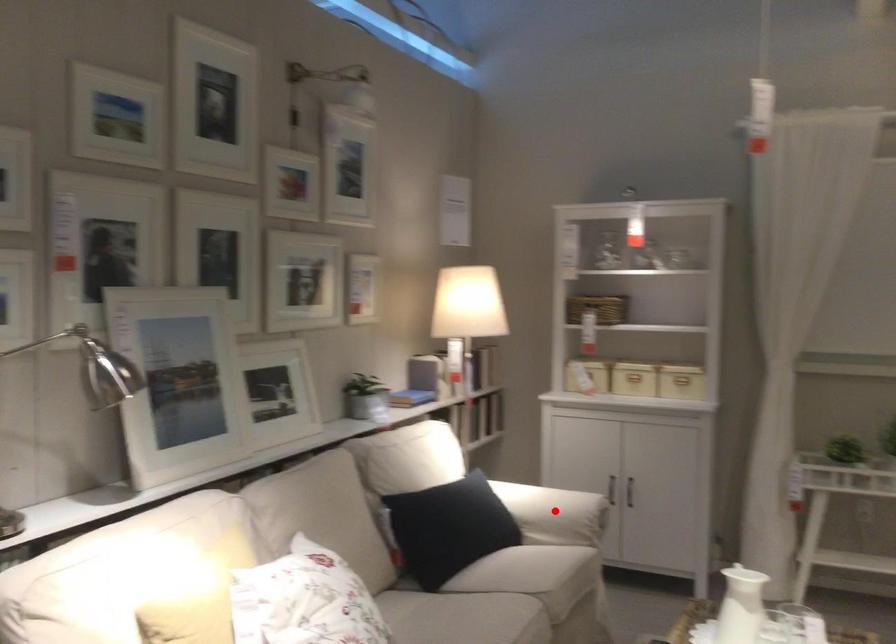
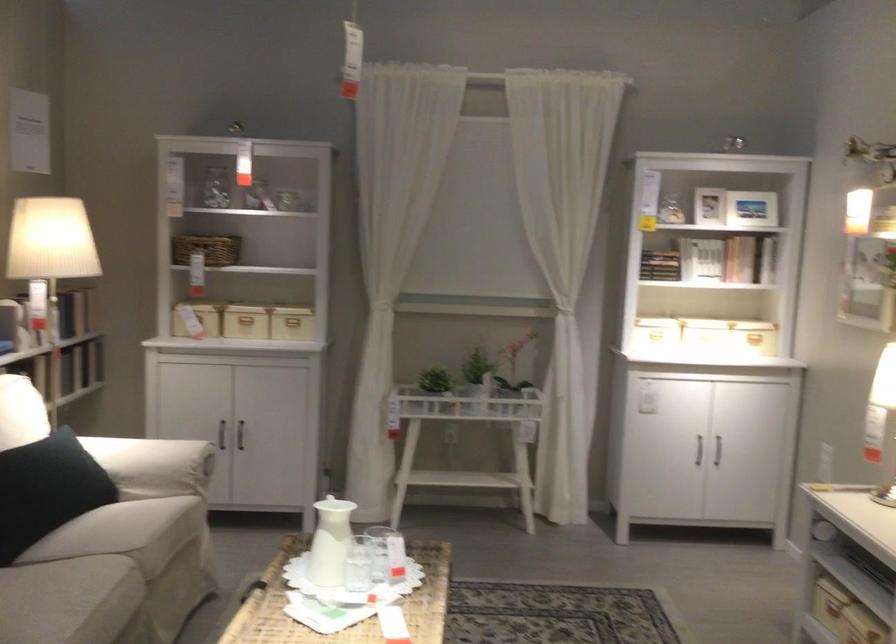
Where in the second image is the point corresponding to the highlighted location from the first image?

(152, 465)